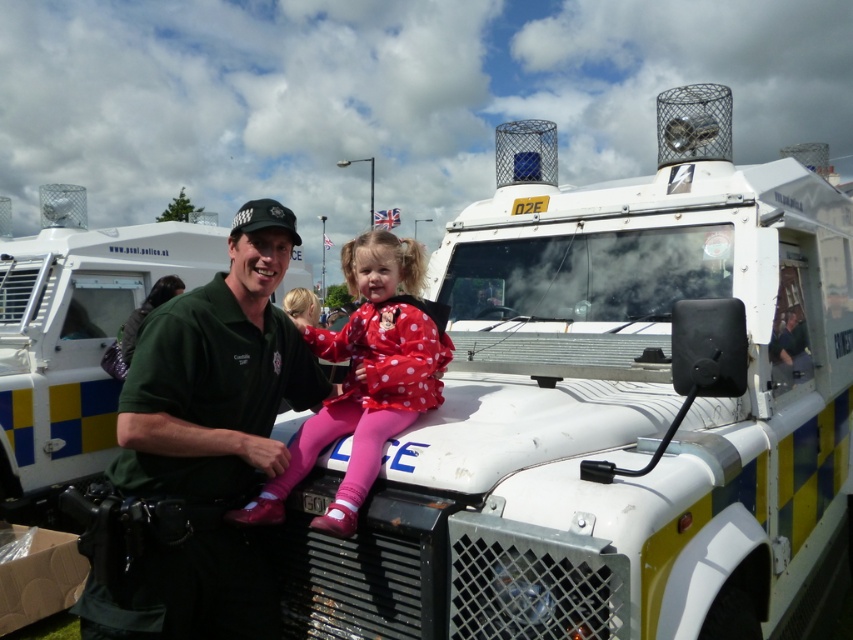
Who is more forward, [213,525] or [131,346]?

Positioned in front is point [213,525].

Identify the location of green uniform at center. (207, 442).

Who is positioned more to the right, green uniform at center or polka dot fabric dress at center?

From the viewer's perspective, polka dot fabric dress at center appears more on the right side.

Is green uniform at center in front of polka dot fabric dress at center?

No.

Does point (204, 428) lie behind point (369, 449)?

No, (204, 428) is in front of (369, 449).

Where is `green uniform at center`? green uniform at center is located at coordinates (207, 442).

Who is positioned more to the left, white matte police vehicle at center or polka dot fabric dress at center?

polka dot fabric dress at center

Does white matte police vehicle at center have a smaller size compared to polka dot fabric dress at center?

Incorrect, white matte police vehicle at center is not smaller in size than polka dot fabric dress at center.

This screenshot has height=640, width=853. Describe the element at coordinates (608, 412) in the screenshot. I see `white matte police vehicle at center` at that location.

Where is `white matte police vehicle at center`? This screenshot has height=640, width=853. white matte police vehicle at center is located at coordinates (608, 412).